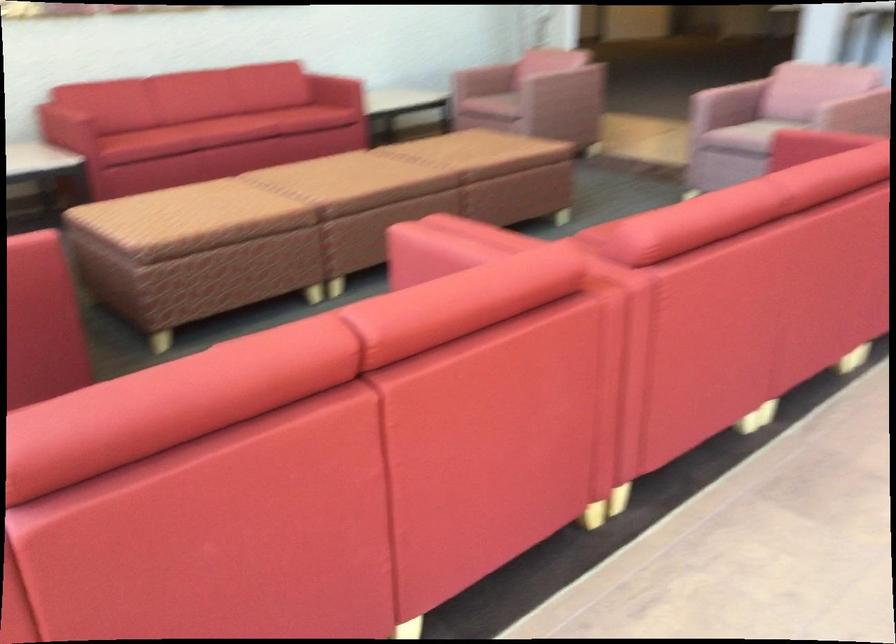
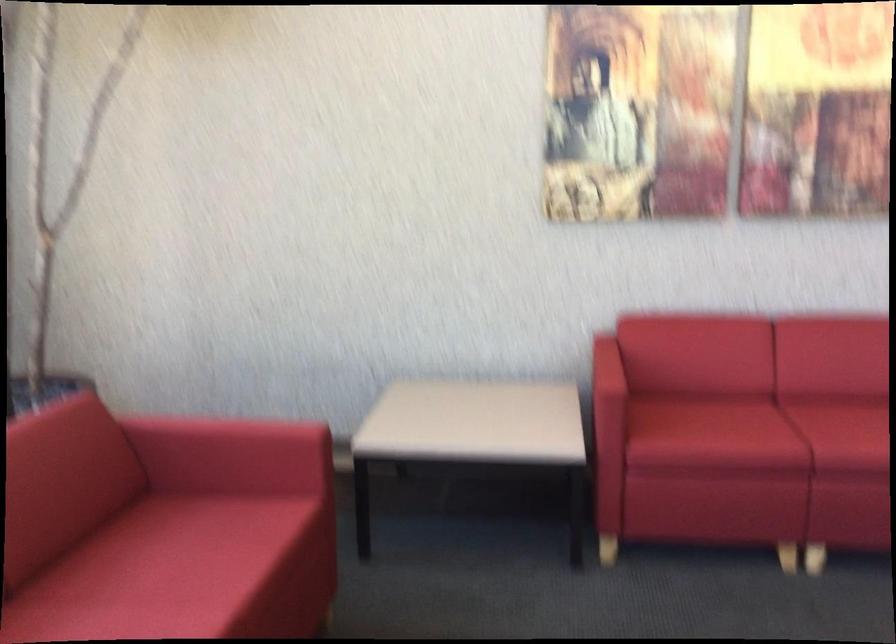
Where in the second image is the point corresponding to (81,108) from the first image?

(607, 377)